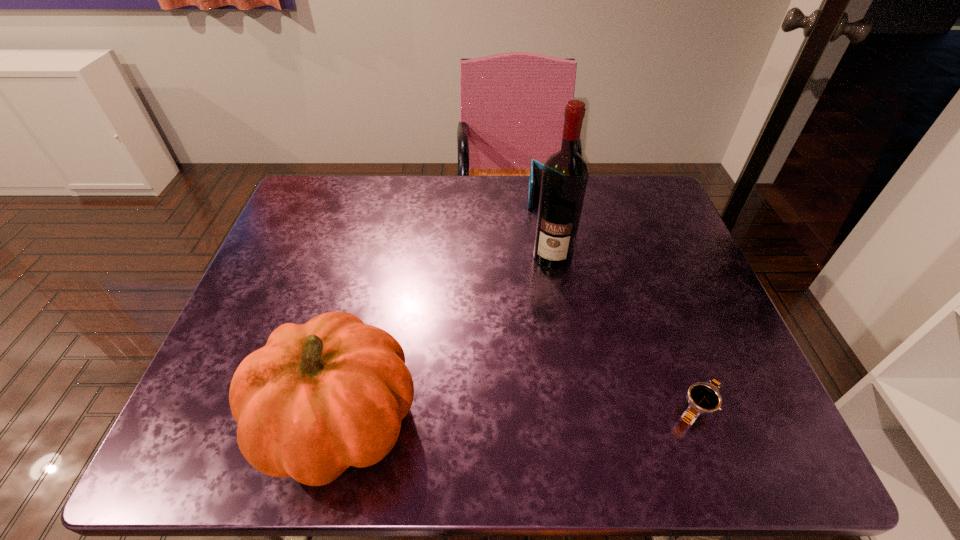
This screenshot has height=540, width=960. What are the coordinates of `free region located 0.090m on the front and back of the second farthest object` in the screenshot? It's located at (543, 295).

Locate an element on the screen. The image size is (960, 540). vacant space located 0.090m on the front and back of the second farthest object is located at coordinates pyautogui.click(x=543, y=295).

Find the location of a particular element. vacant space positioned 0.400m on the front and back of the second farthest object is located at coordinates (517, 408).

At what (x,y) coordinates should I click in order to perform the action: click on free space located on the exterior surface of the wallet. Please return your answer as a coordinate pair (x, y). Looking at the image, I should click on (544, 227).

Locate an element on the screen. vacant space located 0.120m on the exterior surface of the wallet is located at coordinates (544, 236).

Where is `free space located 0.070m on the exterior surface of the wallet`? free space located 0.070m on the exterior surface of the wallet is located at coordinates (543, 225).

Locate an element on the screen. The image size is (960, 540). object that is at the far edge is located at coordinates (536, 168).

Where is `pumpkin that is at the near edge`? This screenshot has width=960, height=540. pumpkin that is at the near edge is located at coordinates (319, 397).

Find the location of a particular element. The width and height of the screenshot is (960, 540). watch located at the near edge is located at coordinates (703, 397).

I want to click on object at the left edge, so click(319, 397).